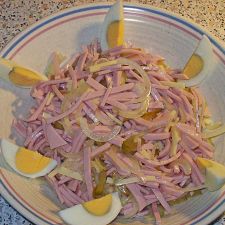
Where is `plate`? This screenshot has height=225, width=225. plate is located at coordinates pyautogui.click(x=20, y=191).